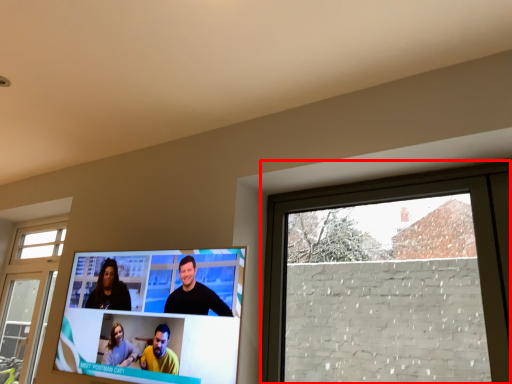
Question: Where is window (annotated by the red box) located in relation to television in the image?

Choices:
 (A) right
 (B) left

Answer: (A)